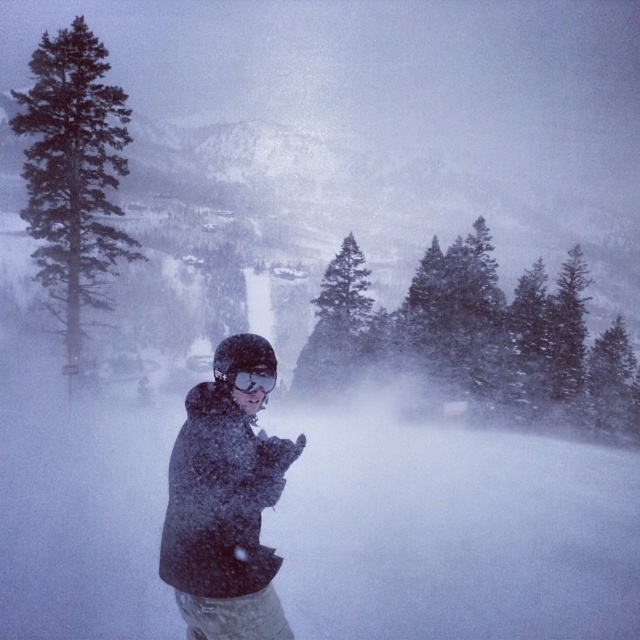
You are a photographer trying to capture the dark green textured pine tree at left and the matte black goggles at center in the same frame. Which object should you focus on first to ensure both are in the shot?

The dark green textured pine tree at left is taller than the matte black goggles at center, so you should focus on the pine tree first to ensure both are in the shot.

You are a hiker trying to locate a dark gray fleece jacket at center in a snowstorm. The coordinates given are point (x=225, y=504). Based on the scene description, can you confirm if the jacket is at that point?

Yes, according to the coordinates provided, the dark gray fleece jacket at center is located at point (x=225, y=504).